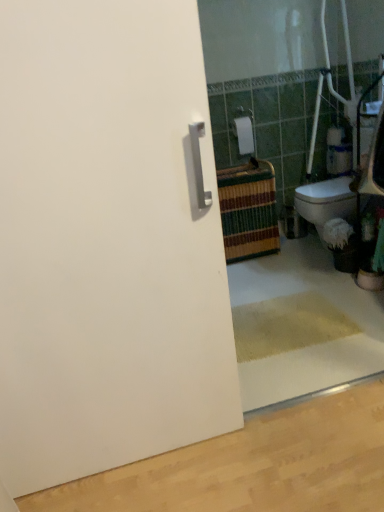
The height and width of the screenshot is (512, 384). Find the location of `white matte toilet paper at upper center`. white matte toilet paper at upper center is located at coordinates point(244,135).

What do you see at coordinates (244, 135) in the screenshot? The height and width of the screenshot is (512, 384). I see `white matte toilet paper at upper center` at bounding box center [244, 135].

Image resolution: width=384 pixels, height=512 pixels. What do you see at coordinates (107, 242) in the screenshot?
I see `white matte door at left` at bounding box center [107, 242].

The image size is (384, 512). I want to click on white matte door at left, so click(107, 242).

The width and height of the screenshot is (384, 512). Identify the location of white matte toilet paper at upper center. (244, 135).

Based on their positions, is white matte door at left located to the left or right of white matte toilet paper at upper center?

white matte door at left is to the left of white matte toilet paper at upper center.

Which object is further away from the camera, white matte door at left or white matte toilet paper at upper center?

white matte toilet paper at upper center is further from the camera.

Is point (60, 370) positioned before point (247, 145)?

That is True.

From the image's perspective, which object appears higher, white matte door at left or white matte toilet paper at upper center?

white matte toilet paper at upper center appears higher in the image.

From a real-world perspective, which object stands above the other?

white matte toilet paper at upper center is physically above.

Does white matte door at left have a greater width compared to white matte toilet paper at upper center?

Incorrect, the width of white matte door at left does not surpass that of white matte toilet paper at upper center.

Does white matte door at left have a lesser height compared to white matte toilet paper at upper center?

No.

Looking at the image, does white matte door at left seem bigger or smaller compared to white matte toilet paper at upper center?

In the image, white matte door at left appears to be larger than white matte toilet paper at upper center.

Is white matte toilet paper at upper center located within white matte door at left?

No.

Is white matte door at left positioned far away from white matte toilet paper at upper center?

Indeed, white matte door at left is not near white matte toilet paper at upper center.

Could you tell me if white matte door at left is turned towards white matte toilet paper at upper center?

No, white matte door at left is not facing towards white matte toilet paper at upper center.

What's the angular difference between white matte door at left and white matte toilet paper at upper center's facing directions?

There is a 1.21-degree angle between the facing directions of white matte door at left and white matte toilet paper at upper center.

In order to click on door below the white matte toilet paper at upper center (from a real-world perspective) in this screenshot , I will do `click(107, 242)`.

Consider the image. Is white matte toilet paper at upper center to the left of white matte door at left from the viewer's perspective?

In fact, white matte toilet paper at upper center is to the right of white matte door at left.

Is white matte toilet paper at upper center behind white matte door at left?

Yes, white matte toilet paper at upper center is behind white matte door at left.

Considering the points (244, 147) and (208, 420), which point is behind, point (244, 147) or point (208, 420)?

Positioned behind is point (244, 147).

From the image's perspective, is white matte toilet paper at upper center located above white matte door at left?

Yes, from the image's perspective, white matte toilet paper at upper center is above white matte door at left.

From a real-world perspective, is white matte toilet paper at upper center located beneath white matte door at left?

No.

Considering the relative sizes of white matte toilet paper at upper center and white matte door at left in the image provided, is white matte toilet paper at upper center thinner than white matte door at left?

No, white matte toilet paper at upper center is not thinner than white matte door at left.

Does white matte toilet paper at upper center have a lesser height compared to white matte door at left?

Indeed, white matte toilet paper at upper center has a lesser height compared to white matte door at left.

Based on their sizes in the image, would you say white matte toilet paper at upper center is bigger or smaller than white matte door at left?

In the image, white matte toilet paper at upper center appears to be smaller than white matte door at left.

Is white matte toilet paper at upper center inside or outside of white matte door at left?

white matte toilet paper at upper center is outside white matte door at left.

Is white matte toilet paper at upper center far from white matte door at left?

Yes, white matte toilet paper at upper center is far from white matte door at left.

Is white matte toilet paper at upper center positioned with its back to white matte door at left?

No, white matte door at left is not at the back of white matte toilet paper at upper center.

How many degrees apart are the facing directions of white matte toilet paper at upper center and white matte door at left?

They differ by 1.21 degrees in their facing directions.

This screenshot has height=512, width=384. I want to click on door on the left of white matte toilet paper at upper center, so click(107, 242).

Locate an element on the screen. The height and width of the screenshot is (512, 384). door below the white matte toilet paper at upper center (from a real-world perspective) is located at coordinates coord(107,242).

Identify the location of door that is in front of the white matte toilet paper at upper center. (107, 242).